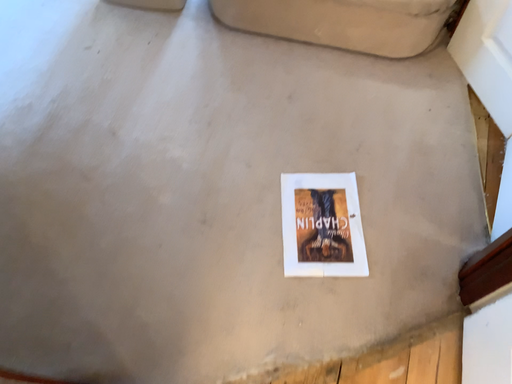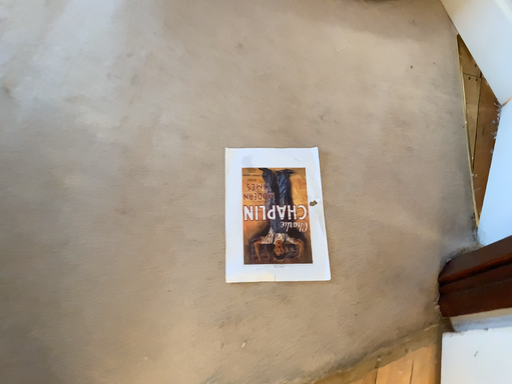
Question: How did the camera likely rotate when shooting the video?

Choices:
 (A) rotated downward
 (B) rotated upward

Answer: (A)